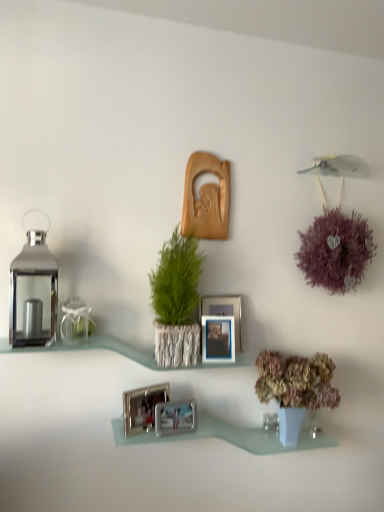
Question: Does silver metallic photo frame at center, which ranks as the fifth picture frame in top-to-bottom order, contain clear glass shelf at center, the second shelf ordered from the bottom?

Choices:
 (A) yes
 (B) no

Answer: (B)

Question: Does silver metallic photo frame at center, arranged as the 1th picture frame when ordered from the bottom, lie in front of clear glass shelf at center, the second shelf ordered from the bottom?

Choices:
 (A) yes
 (B) no

Answer: (B)

Question: From a real-world perspective, is silver metallic photo frame at center, arranged as the 1th picture frame when ordered from the bottom, positioned over clear glass shelf at center, which is the first shelf in top-to-bottom order, based on gravity?

Choices:
 (A) yes
 (B) no

Answer: (B)

Question: From the image's perspective, is silver metallic photo frame at center, arranged as the 1th picture frame when ordered from the bottom, over clear glass shelf at center, which is the first shelf in top-to-bottom order?

Choices:
 (A) no
 (B) yes

Answer: (A)

Question: Does silver metallic photo frame at center, which ranks as the fifth picture frame in top-to-bottom order, touch clear glass shelf at center, the second shelf ordered from the bottom?

Choices:
 (A) no
 (B) yes

Answer: (A)

Question: From a real-world perspective, does silver metallic photo frame at center, which ranks as the fifth picture frame in top-to-bottom order, sit lower than clear glass shelf at center, which is the first shelf in top-to-bottom order?

Choices:
 (A) yes
 (B) no

Answer: (A)

Question: Can you confirm if silver metallic photo frame at lower center, which appears as the second picture frame when ordered from the bottom, is taller than metallic silver picture frame at center, which is counted as the third picture frame, starting from the bottom?

Choices:
 (A) yes
 (B) no

Answer: (B)

Question: From a real-world perspective, is silver metallic photo frame at lower center, which appears as the second picture frame when ordered from the bottom, on top of metallic silver picture frame at center, which is counted as the third picture frame, starting from the bottom?

Choices:
 (A) no
 (B) yes

Answer: (A)

Question: Is silver metallic photo frame at lower center, which appears as the second picture frame when ordered from the bottom, bigger than metallic silver picture frame at center, which is the 3th picture frame in top-to-bottom order?

Choices:
 (A) yes
 (B) no

Answer: (B)

Question: Is silver metallic photo frame at lower center, the fourth picture frame viewed from the top, turned away from metallic silver picture frame at center, which is the 3th picture frame in top-to-bottom order?

Choices:
 (A) no
 (B) yes

Answer: (A)

Question: Is silver metallic photo frame at lower center, the fourth picture frame viewed from the top, closer to the viewer compared to metallic silver picture frame at center, which is counted as the third picture frame, starting from the bottom?

Choices:
 (A) yes
 (B) no

Answer: (A)

Question: Is silver metallic photo frame at lower center, the fourth picture frame viewed from the top, smaller than metallic silver picture frame at center, which is the 3th picture frame in top-to-bottom order?

Choices:
 (A) yes
 (B) no

Answer: (A)

Question: Can you confirm if clear glass shelf at center, which is the first shelf in top-to-bottom order, is thinner than purple fluffy ball at upper right?

Choices:
 (A) yes
 (B) no

Answer: (B)